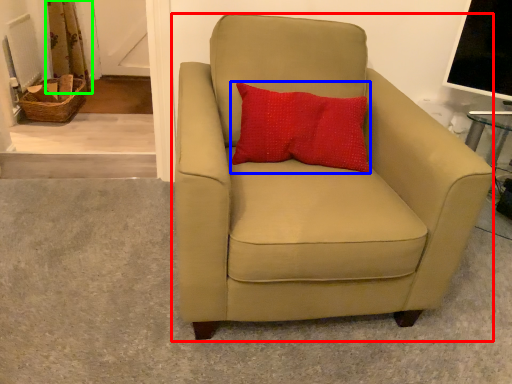
Question: Estimate the real-world distances between objects in this image. Which object is farther from chair (highlighted by a red box), pillow (highlighted by a blue box) or curtain (highlighted by a green box)?

Choices:
 (A) pillow
 (B) curtain

Answer: (B)